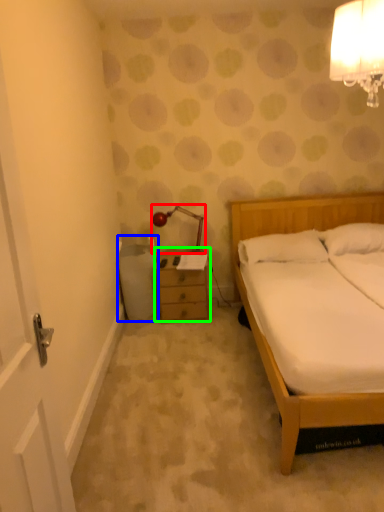
Question: Which is farther away from lamp (highlighted by a red box)? trash bin/can (highlighted by a blue box) or chest of drawers (highlighted by a green box)?

Choices:
 (A) trash bin/can
 (B) chest of drawers

Answer: (A)